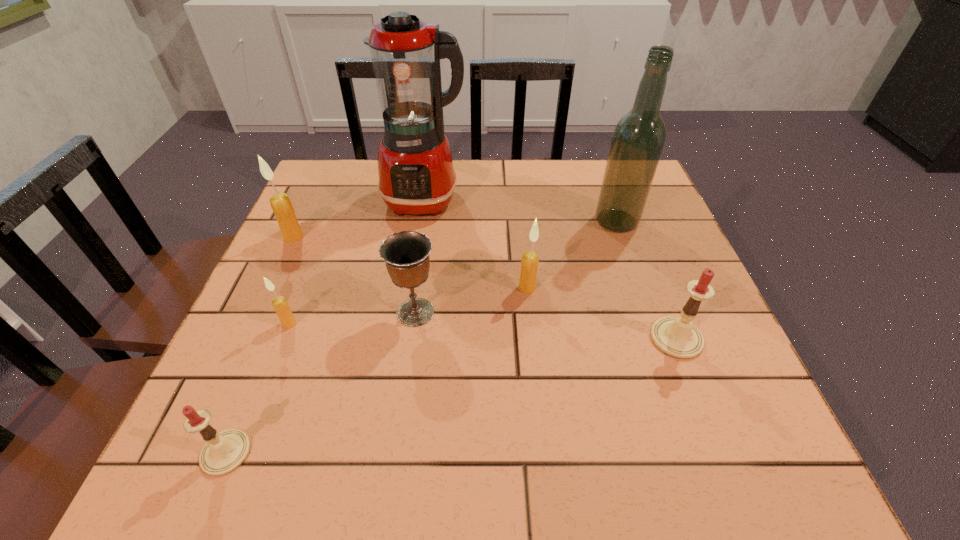
Where is `the second cream candle from right to left`? The image size is (960, 540). the second cream candle from right to left is located at coordinates (281, 306).

Identify the location of the smaller red candle. (224, 452).

The width and height of the screenshot is (960, 540). I want to click on the nearest candle, so click(x=224, y=452).

Image resolution: width=960 pixels, height=540 pixels. Identify the location of free space located on the controls of the food processor. (402, 346).

The height and width of the screenshot is (540, 960). I want to click on free region located on the left of the liquor, so click(x=530, y=221).

You are a GUI agent. You are given a task and a screenshot of the screen. Output one action in this format:
    pyautogui.click(x=<x>, y=<y>)
    Task: Click on the free space located on the back of the leftmost cream candle
    This screenshot has height=540, width=960.
    Given the screenshot: What is the action you would take?
    pyautogui.click(x=309, y=204)

The height and width of the screenshot is (540, 960). I want to click on free space located 0.190m on the back of the second candle from right to left, so click(x=521, y=226).

Where is `vacant area situated on the back of the right red candle`? vacant area situated on the back of the right red candle is located at coordinates (654, 279).

Locate an element on the screen. This screenshot has width=960, height=540. blank space located 0.180m on the back of the bronze chalice is located at coordinates click(x=425, y=239).

I want to click on free space located on the back of the second cream candle from right to left, so click(310, 269).